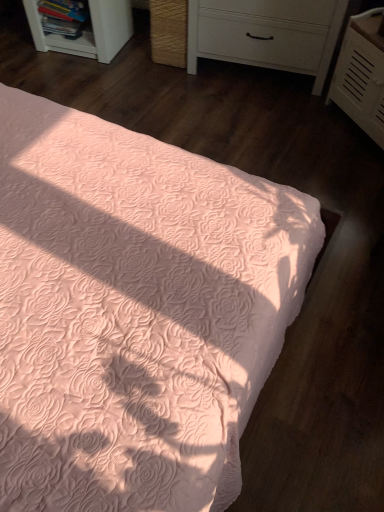
Locate an element on the screen. free space in front of white plastic shelf at upper left is located at coordinates (77, 78).